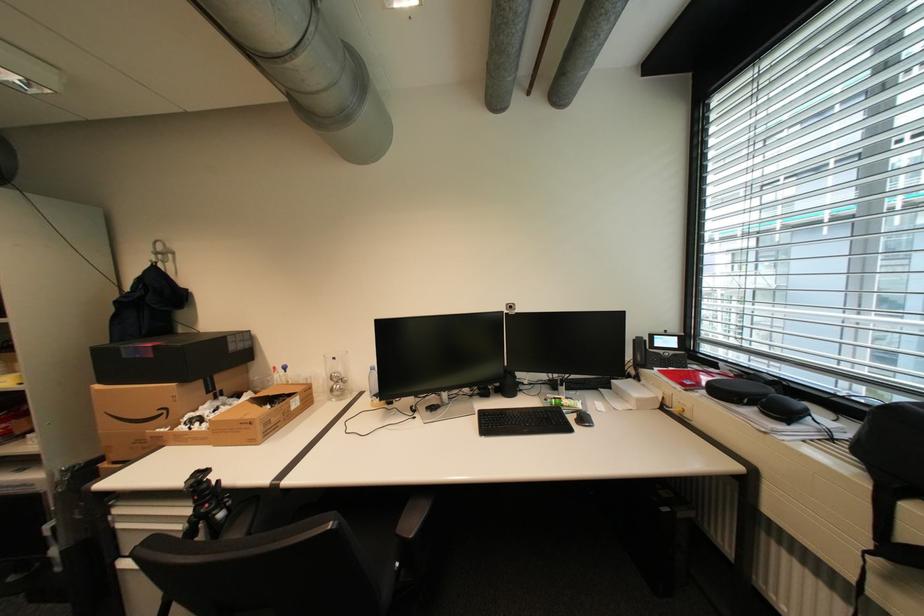
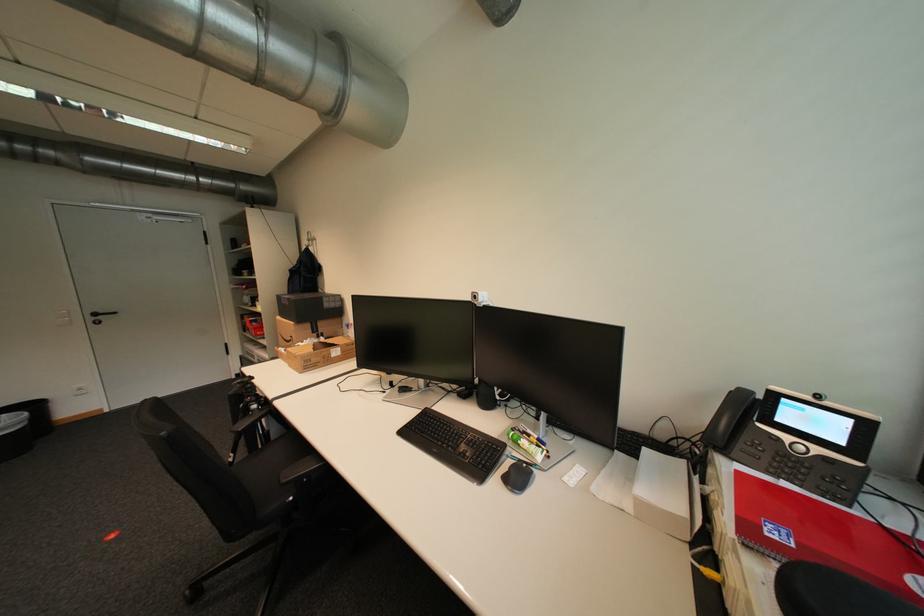
Where in the second image is the point corresponding to (x=161, y=357) from the first image?

(296, 305)